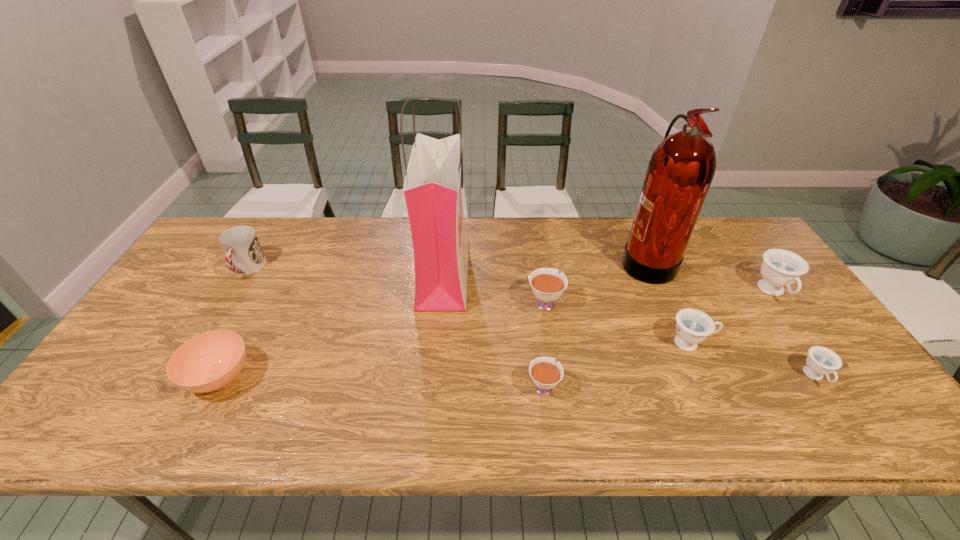
What are the coordinates of `the nearest blue teacup` in the screenshot? It's located at (821, 361).

The image size is (960, 540). I want to click on vacant space situated 0.350m on the front-facing side of the fire extinguisher, so click(x=508, y=260).

Find the location of a particular element. This screenshot has width=960, height=540. free location located on the front-facing side of the fire extinguisher is located at coordinates (568, 260).

At what (x,y) coordinates should I click in order to perform the action: click on vacant space located 0.320m on the front-facing side of the fire extinguisher. Please return your answer as a coordinate pair (x, y). Image resolution: width=960 pixels, height=540 pixels. Looking at the image, I should click on 517,260.

The image size is (960, 540). I want to click on vacant space situated 0.340m on the front-facing side of the seventh object from right to left, so click(579, 271).

In order to click on free spot located 0.360m on the side of the cup where the handle is located in this screenshot , I will do `click(176, 388)`.

Identify the location of free space located on the side of the biggest blue teacup with the handle. (854, 407).

In order to click on vacant position located on the side of the farther white teacup with the handle in this screenshot , I will do `click(538, 253)`.

Find the location of a particular element. The height and width of the screenshot is (540, 960). vacant space located 0.340m on the side of the farther white teacup with the handle is located at coordinates (533, 221).

At what (x,y) coordinates should I click in order to perform the action: click on blank space located on the side of the farther white teacup with the handle. Please return your answer as a coordinate pair (x, y). This screenshot has width=960, height=540. Looking at the image, I should click on (538, 253).